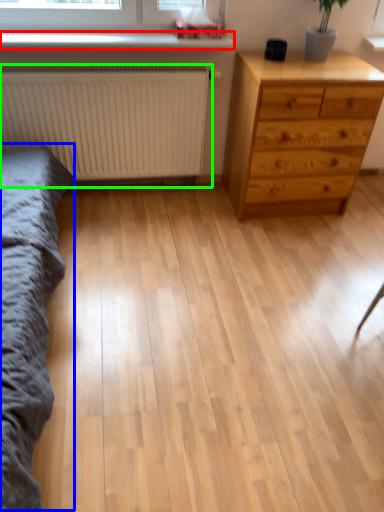
Question: Based on their relative distances, which object is nearer to window sill (highlighted by a red box)? Choose from bed frame (highlighted by a blue box) and radiator (highlighted by a green box).

Choices:
 (A) bed frame
 (B) radiator

Answer: (B)